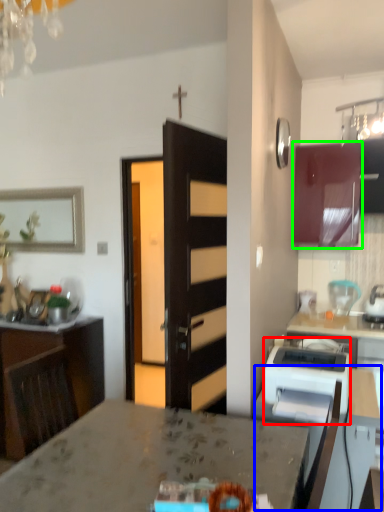
Question: Estimate the real-world distances between objects in this image. Which object is closer to appliance (highlighted by a red box), table (highlighted by a blue box) or cabinetry (highlighted by a green box)?

Choices:
 (A) table
 (B) cabinetry

Answer: (A)